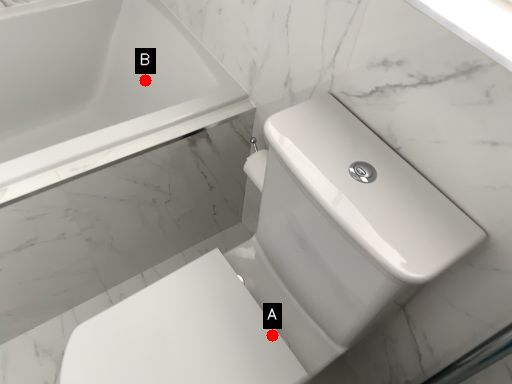
Question: Two points are circled on the image, labeled by A and B beside each circle. Which point is closer to the camera taking this photo?

Choices:
 (A) A is closer
 (B) B is closer

Answer: (A)